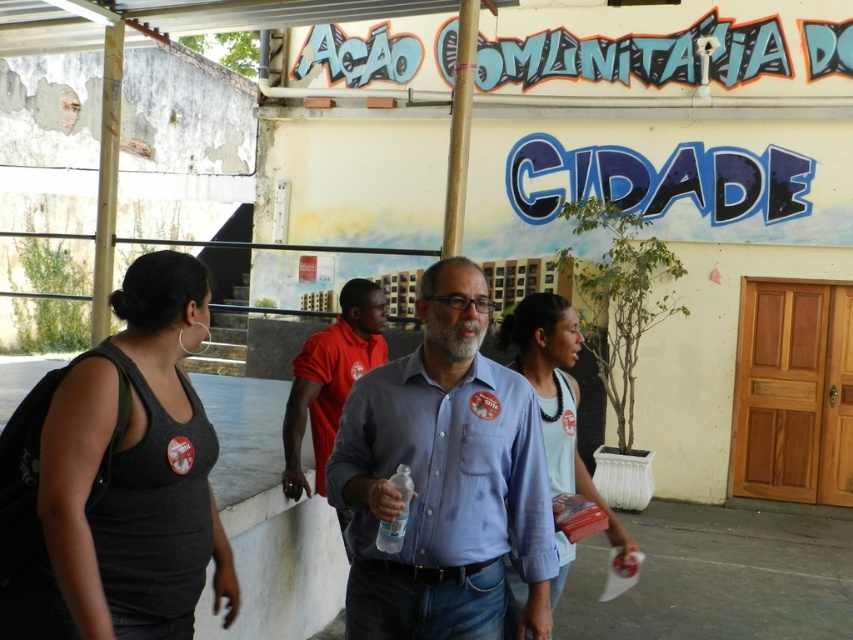
Question: Which of the following is the farthest from the observer?

Choices:
 (A) (573, 346)
 (B) (113, 403)
 (C) (381, 304)
 (D) (527, 412)

Answer: (C)

Question: Which point is farther from the camera taking this photo?

Choices:
 (A) (344, 314)
 (B) (119, 637)
 (C) (450, 288)
 (D) (561, 333)

Answer: (A)

Question: Which object appears farthest from the camera in this image?

Choices:
 (A) gray fabric tank top at left
 (B) blue cotton shirt at center

Answer: (B)

Question: Does blue cotton shirt at center appear under gray fabric tank top at left?

Choices:
 (A) no
 (B) yes

Answer: (B)

Question: Does blue cotton shirt at center have a larger size compared to red cotton shirt at center?

Choices:
 (A) no
 (B) yes

Answer: (A)

Question: Is blue cotton shirt at center behind red cotton shirt at center?

Choices:
 (A) no
 (B) yes

Answer: (A)